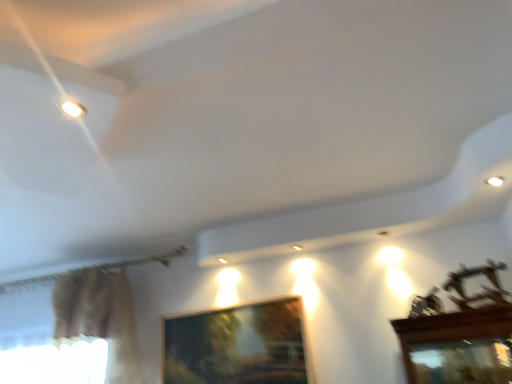
What do you see at coordinates (236, 346) in the screenshot? The width and height of the screenshot is (512, 384). I see `wooden framed painting at center` at bounding box center [236, 346].

This screenshot has width=512, height=384. Find the location of `wooden framed painting at center`. wooden framed painting at center is located at coordinates (236, 346).

The image size is (512, 384). What are the coordinates of `wooden framed painting at center` in the screenshot? It's located at pyautogui.click(x=236, y=346).